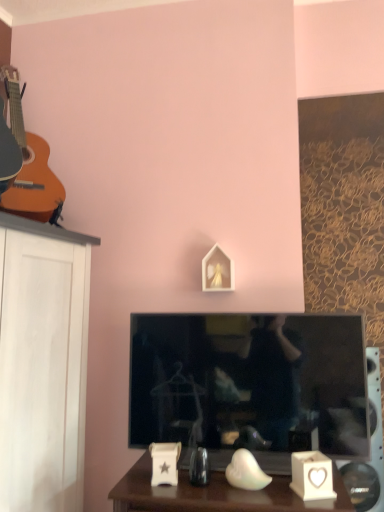
Question: Is white matte picture frame at center turned away from black glossy television at center?

Choices:
 (A) yes
 (B) no

Answer: (B)

Question: Can you confirm if white matte picture frame at center is bigger than black glossy television at center?

Choices:
 (A) yes
 (B) no

Answer: (B)

Question: Does white matte picture frame at center appear on the right side of black glossy television at center?

Choices:
 (A) yes
 (B) no

Answer: (B)

Question: Does white matte picture frame at center have a greater height compared to black glossy television at center?

Choices:
 (A) yes
 (B) no

Answer: (B)

Question: Is white matte picture frame at center in front of black glossy television at center?

Choices:
 (A) no
 (B) yes

Answer: (A)

Question: Does point (349, 494) appear closer or farther from the camera than point (291, 480)?

Choices:
 (A) farther
 (B) closer

Answer: (A)

Question: Is white plastic speaker at lower right inside or outside of white ceramic heart-shaped candle holder at lower right?

Choices:
 (A) inside
 (B) outside

Answer: (B)

Question: Would you say white plastic speaker at lower right is to the left or to the right of white ceramic heart-shaped candle holder at lower right in the picture?

Choices:
 (A) right
 (B) left

Answer: (A)

Question: Based on their sizes in the image, would you say white plastic speaker at lower right is bigger or smaller than white ceramic heart-shaped candle holder at lower right?

Choices:
 (A) small
 (B) big

Answer: (B)

Question: Is white matte picture frame at center inside the boundaries of white ceramic heart-shaped candle holder at lower right, or outside?

Choices:
 (A) inside
 (B) outside

Answer: (B)

Question: Is point click(x=203, y=284) closer or farther from the camera than point click(x=304, y=473)?

Choices:
 (A) closer
 (B) farther

Answer: (B)

Question: From a real-world perspective, relative to white ceramic heart-shaped candle holder at lower right, is white matte picture frame at center vertically above or below?

Choices:
 (A) above
 (B) below

Answer: (A)

Question: Looking at their shapes, would you say white matte picture frame at center is wider or thinner than white ceramic heart-shaped candle holder at lower right?

Choices:
 (A) wide
 (B) thin

Answer: (B)

Question: Considering the positions of white ceramic heart-shaped candle holder at lower right and white plastic speaker at lower right in the image, is white ceramic heart-shaped candle holder at lower right bigger or smaller than white plastic speaker at lower right?

Choices:
 (A) small
 (B) big

Answer: (A)

Question: Is white ceramic heart-shaped candle holder at lower right in front of or behind white plastic speaker at lower right in the image?

Choices:
 (A) behind
 (B) front

Answer: (B)